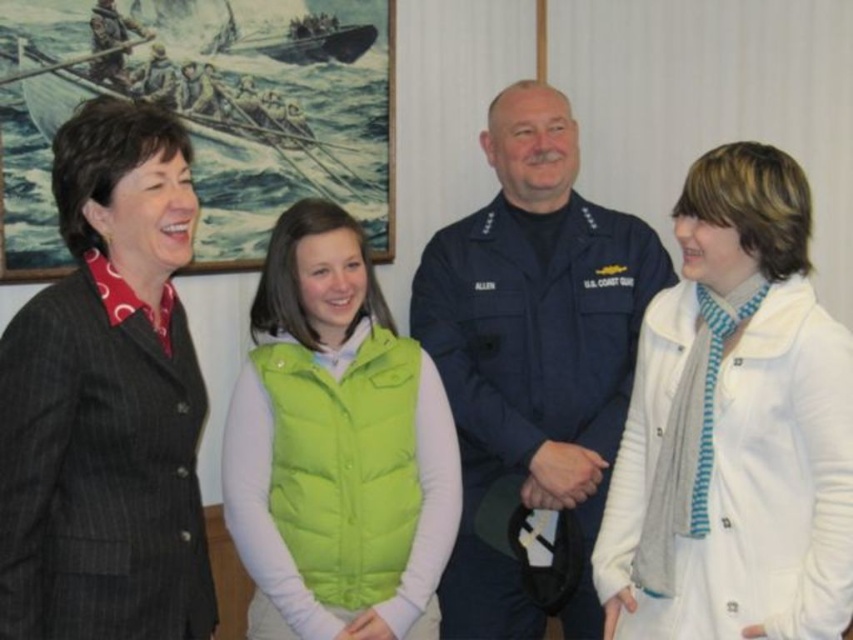
You are a photographer standing between the white cotton coat at right and the dark gray pinstripe suit at left. You need to take a photo of both of them in the same frame. Given that your camera has a minimum focus distance of 1 meter, will you be able to capture both subjects clearly?

The distance between the white cotton coat at right and the dark gray pinstripe suit at left is 1.01 meters. Since the camera requires a minimum focus distance of 1 meter, the subjects are just barely within range, so yes, you can capture both clearly.